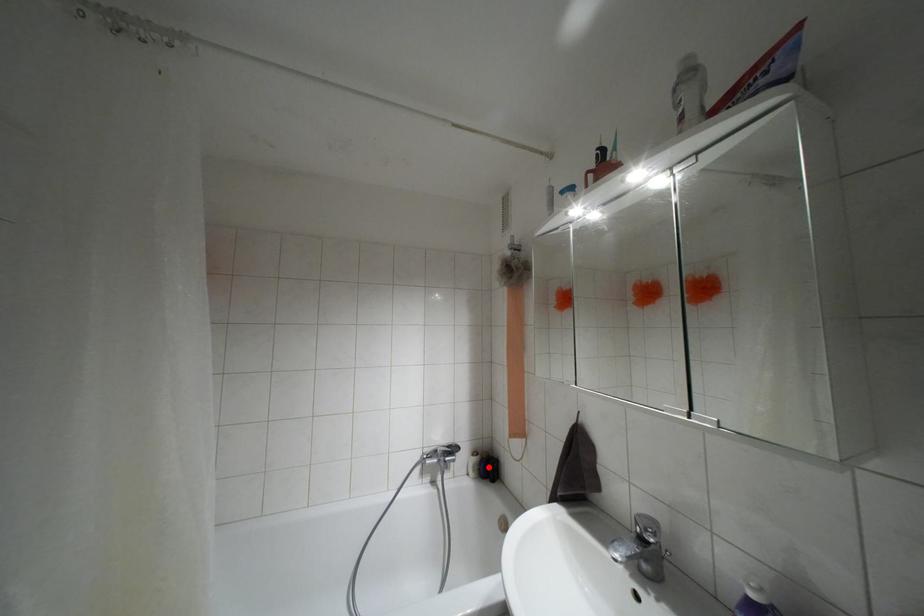
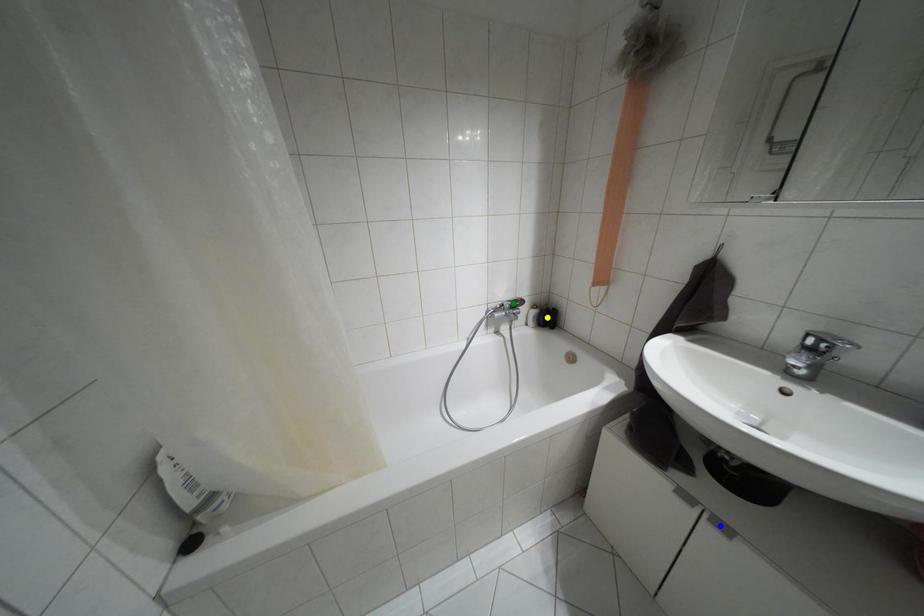
Question: I am providing you with two images of the same scene from different viewpoints. A red point is marked on the first image. You are given multiple points on the second image. Can you choose the point in image 2 that corresponds to the point in image 1?

Choices:
 (A) yellow point
 (B) blue point
 (C) green point

Answer: (A)